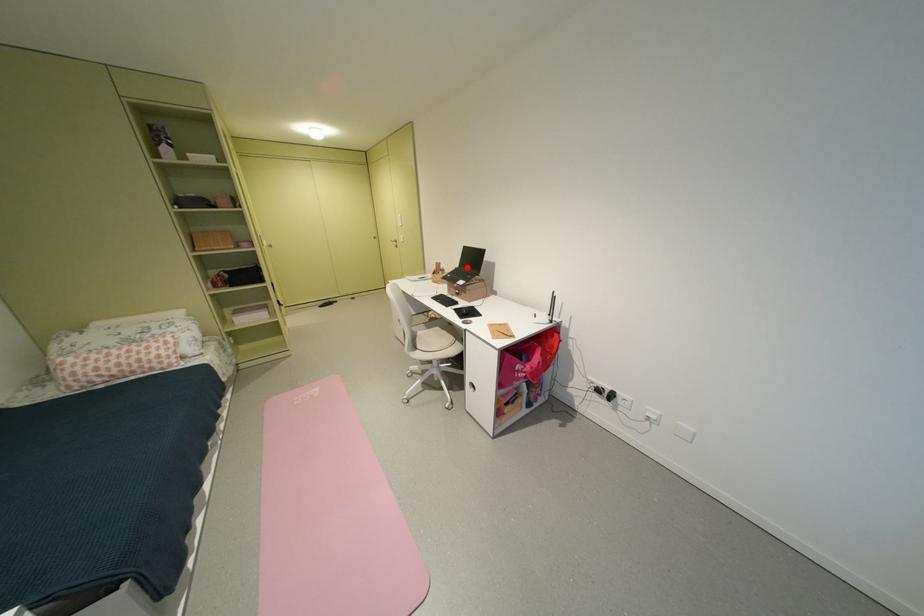
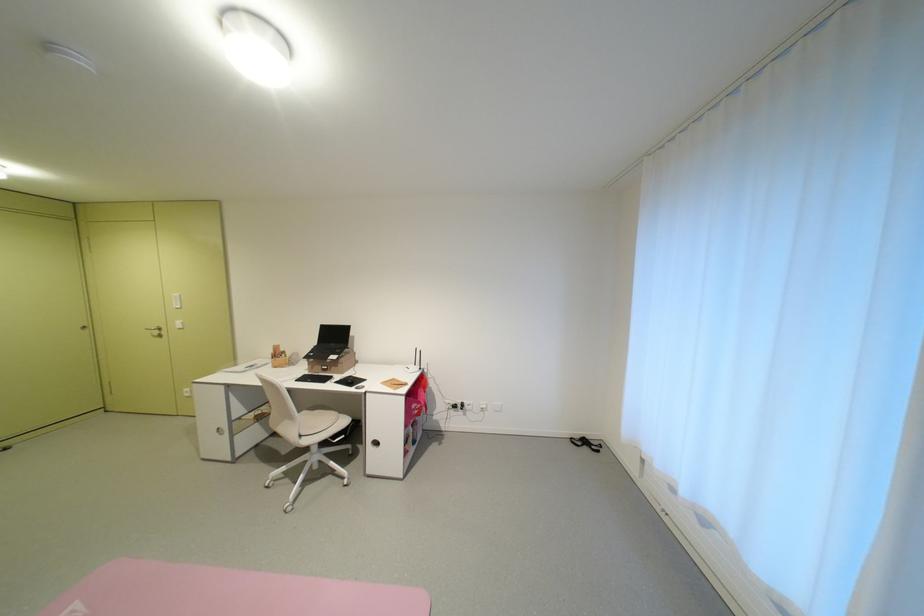
In the second image, find the point that corresponds to the highlighted location in the first image.

(324, 345)